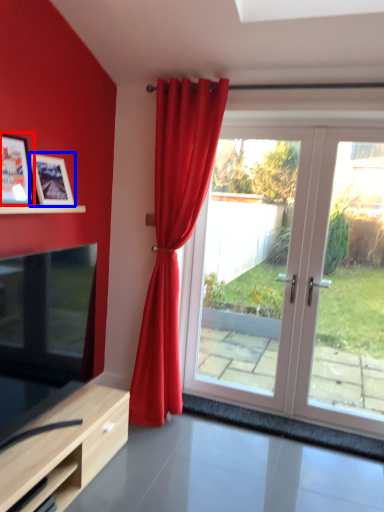
Question: Which object appears farthest to the camera in this image, picture frame (highlighted by a red box) or picture frame (highlighted by a blue box)?

Choices:
 (A) picture frame
 (B) picture frame

Answer: (B)